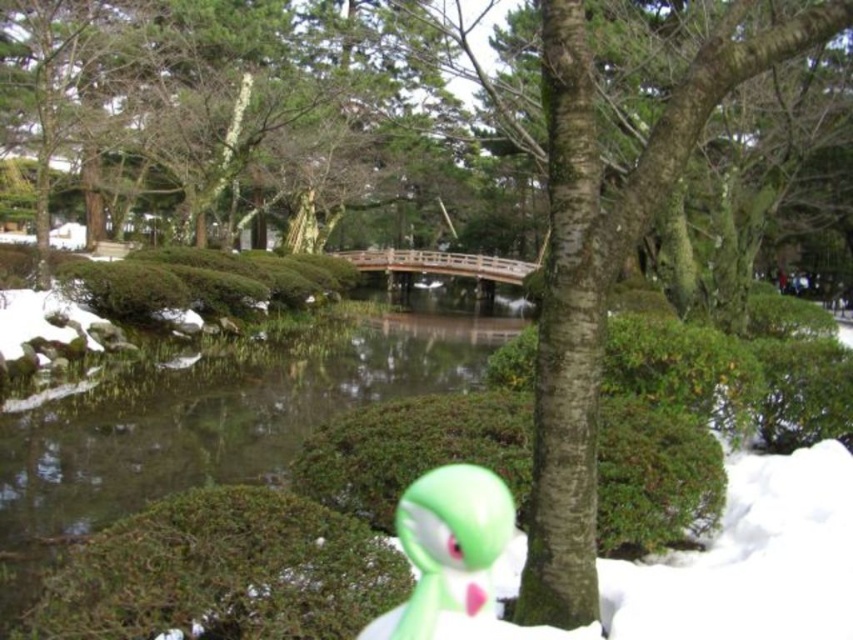
You are standing in a winter garden and see the clear water at center and the green matte toy at center. Which object is located to the right?

The green matte toy at center is located to the right of the clear water at center.

You are standing at point A and want to walk to point B in the winter garden scene. The coordinates of point A are point (283, 420) and point B are point (393, 621). According to the scene description, which point is closer to you?

Point (393, 621) is closer to you because point (283, 420) is behind it.

You are a visitor in the garden and want to place a small snowman decoration on the ground. You see the clear water at center and the green matte toy at center. Which object should you avoid placing the snowman near to prevent it from getting wet?

You should avoid placing the snowman near the clear water at center because it is positioned under the green matte toy at center, meaning the water is below and likely closer to the ground where the snowman would be placed, increasing the risk of the snowman getting wet.